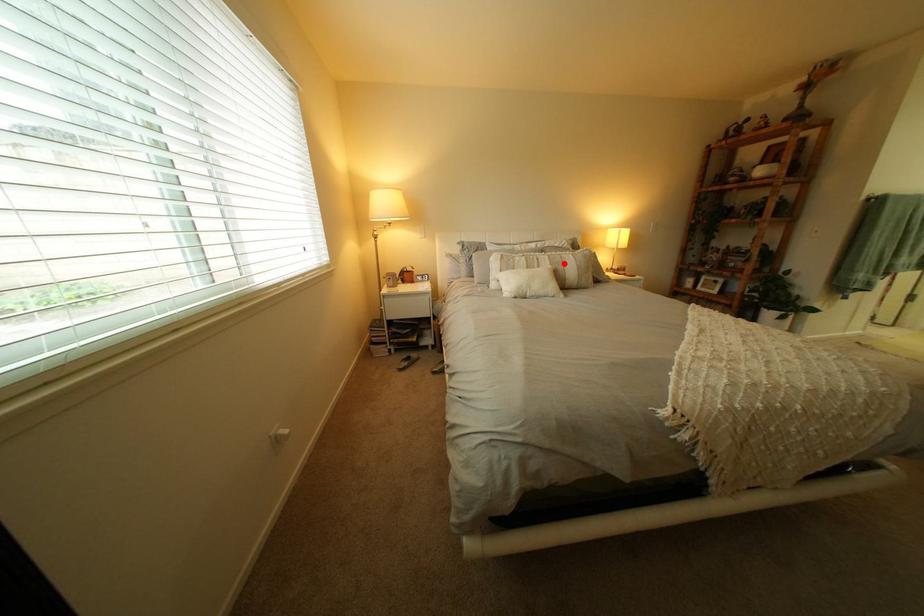
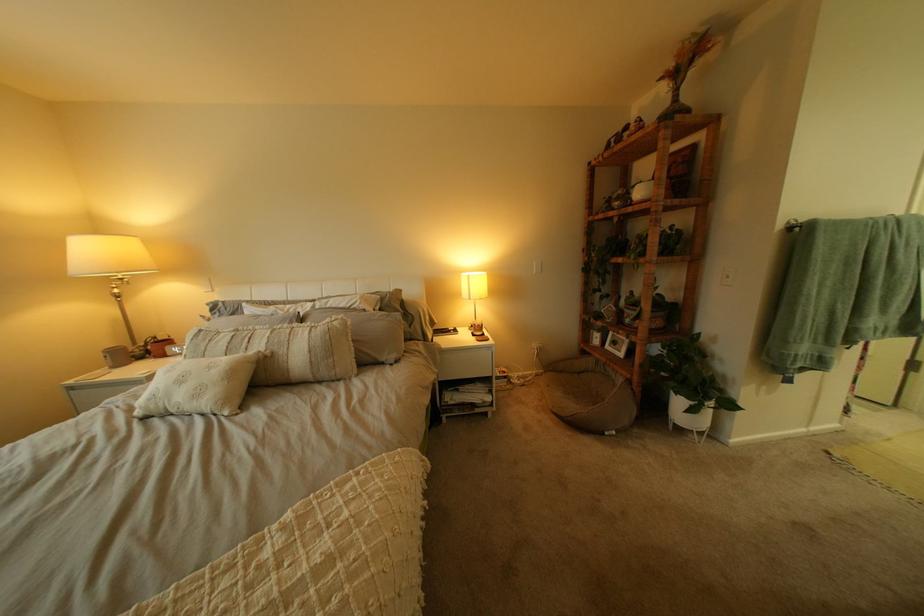
Where in the second image is the point corresponding to the highlighted location from the first image?

(281, 342)